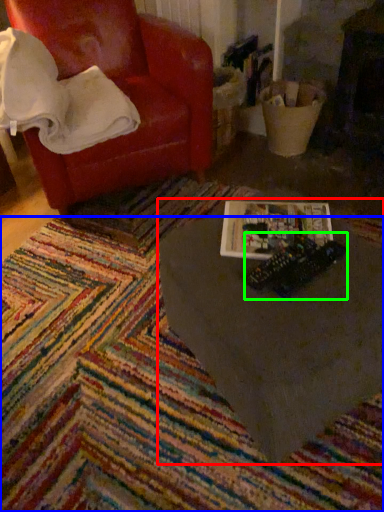
Question: Considering the real-world distances, which object is closest to table (highlighted by a red box)? mat (highlighted by a blue box) or toy (highlighted by a green box).

Choices:
 (A) mat
 (B) toy

Answer: (B)